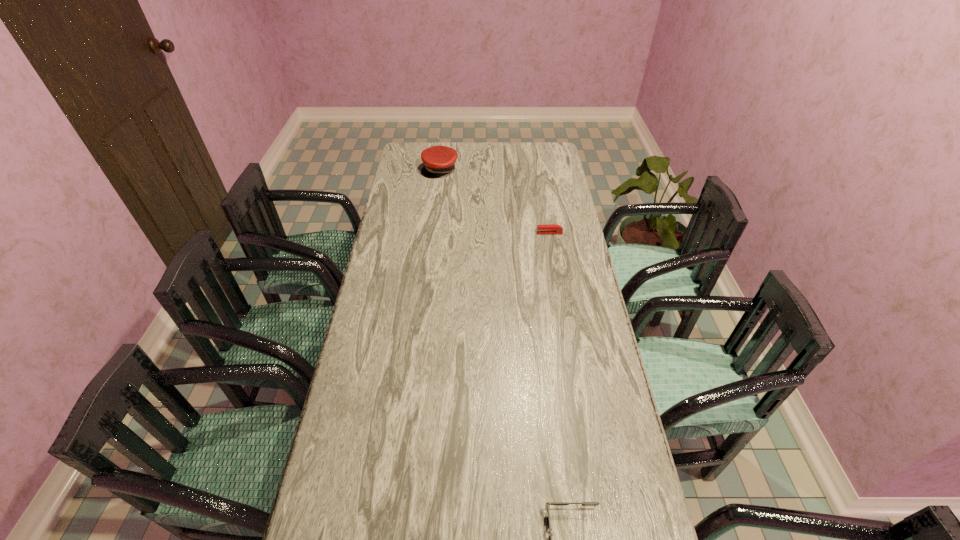
Find the location of a particular element. the farthest object is located at coordinates (439, 160).

I want to click on the tallest object, so click(439, 160).

I want to click on the second nearest object, so click(547, 228).

In order to click on vacant region located 0.230m on the front-facing side of the leftmost object in this screenshot , I will do `click(435, 208)`.

The width and height of the screenshot is (960, 540). What are the coordinates of `vacant space located on the front-facing side of the stapler` in the screenshot? It's located at (516, 233).

Where is `vacant space located 0.330m on the front-facing side of the stapler`? The image size is (960, 540). vacant space located 0.330m on the front-facing side of the stapler is located at coordinates (x=455, y=233).

At what (x,y) coordinates should I click in order to perform the action: click on vacant position located 0.200m on the front-facing side of the stapler. Please return your answer as a coordinate pair (x, y). Looking at the image, I should click on (488, 233).

Where is `object that is positioned at the far edge`? The width and height of the screenshot is (960, 540). object that is positioned at the far edge is located at coordinates (439, 160).

Identify the location of object situated at the left edge. The image size is (960, 540). (439, 160).

The width and height of the screenshot is (960, 540). Find the location of `object at the right edge`. object at the right edge is located at coordinates (547, 228).